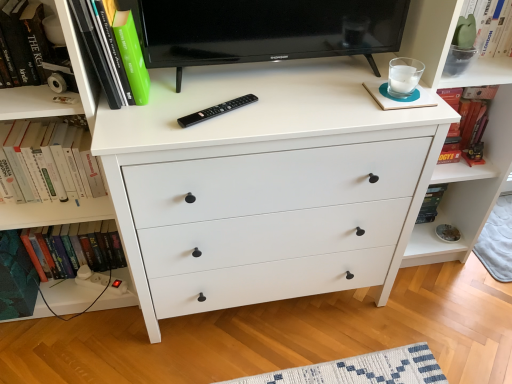
The height and width of the screenshot is (384, 512). Identify the location of vacant space in front of black plastic remote at center. (209, 134).